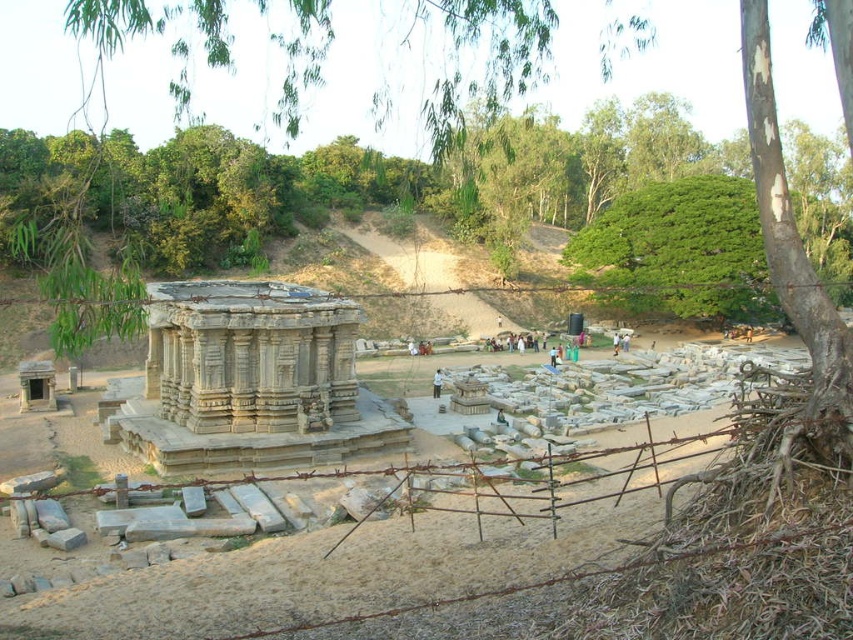
Does gray stone amphitheater at center appear under dark gray stone statue at center?

Actually, gray stone amphitheater at center is above dark gray stone statue at center.

Does gray stone amphitheater at center have a lesser width compared to dark gray stone statue at center?

In fact, gray stone amphitheater at center might be wider than dark gray stone statue at center.

Between point (325, 435) and point (500, 406), which one is positioned in front?

Point (325, 435)

Where is `gray stone amphitheater at center`? This screenshot has width=853, height=640. gray stone amphitheater at center is located at coordinates (250, 381).

Between green leafy tree at upper center and white fabric shirt at center, which one has less height?

Standing shorter between the two is white fabric shirt at center.

Can you confirm if green leafy tree at upper center is smaller than white fabric shirt at center?

Incorrect, green leafy tree at upper center is not smaller in size than white fabric shirt at center.

Does point (93, 83) come closer to viewer compared to point (436, 397)?

No, it is not.

Where is `green leafy tree at upper center`? green leafy tree at upper center is located at coordinates (465, 58).

Is point (399, 433) in front of point (436, 376)?

Yes, it is in front of point (436, 376).

Is gray stone amphitheater at center further to the viewer compared to white fabric shirt at center?

No, gray stone amphitheater at center is in front of white fabric shirt at center.

Does point (160, 385) come farther from viewer compared to point (438, 390)?

No, (160, 385) is closer to viewer.

I want to click on gray stone amphitheater at center, so click(x=250, y=381).